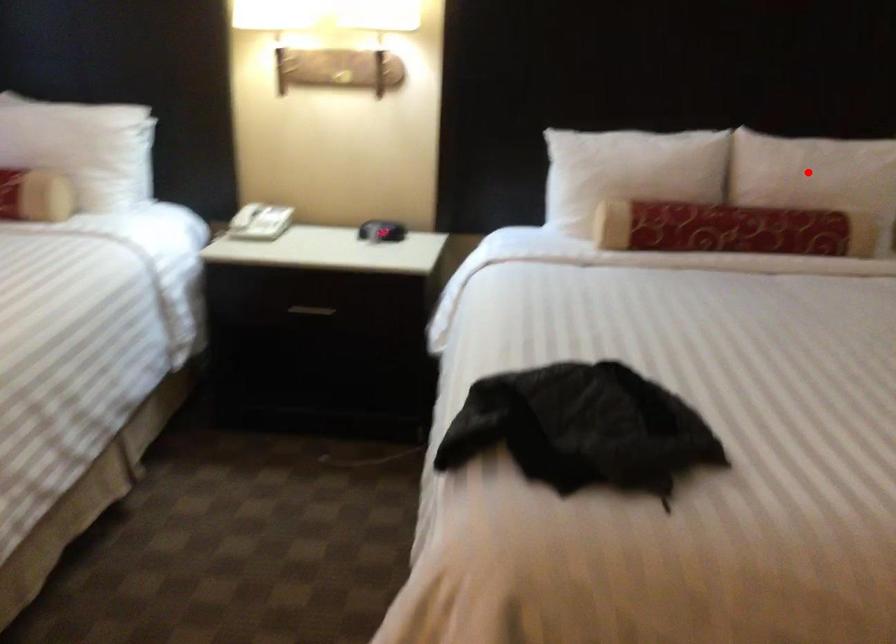
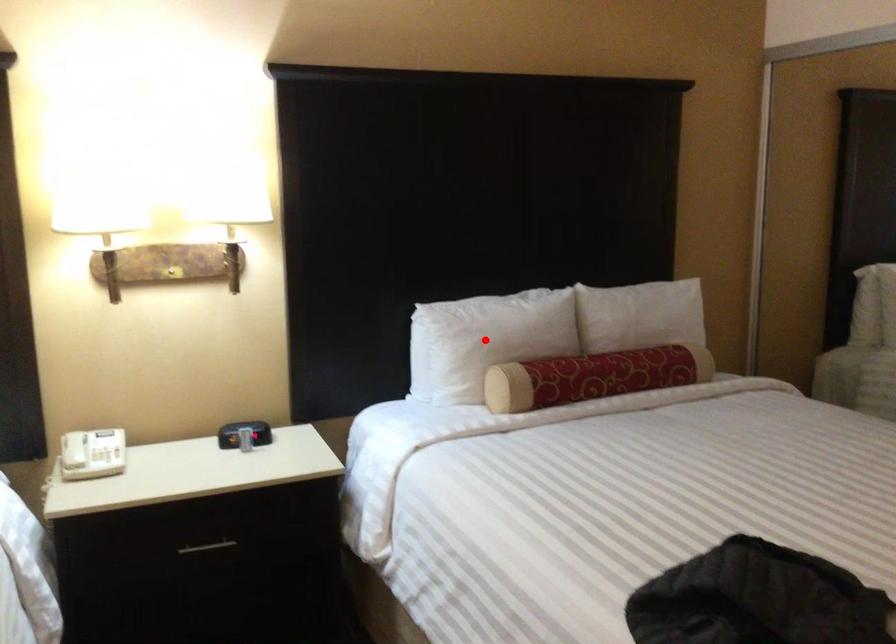
I am providing you with two images of the same scene from different viewpoints. A red point is marked on the first image and another point is marked on the second image. Are the points marked in image1 and image2 representing the same 3D position?

No